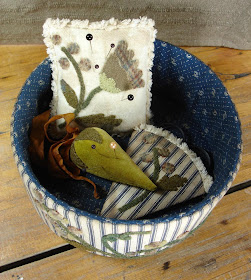
In order to click on aged wood table in this screenshot , I will do pyautogui.click(x=222, y=251).